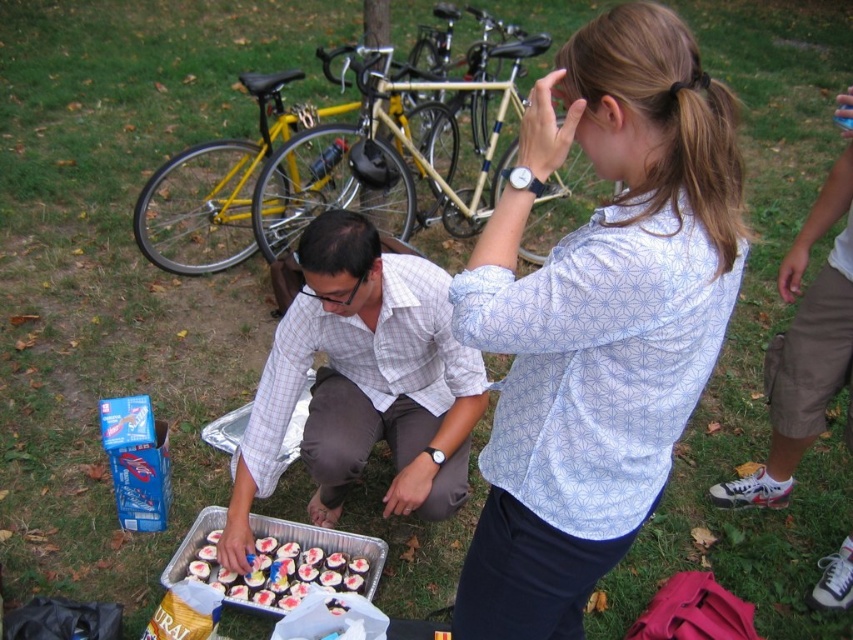
Question: Among these points, which one is nearest to the camera?

Choices:
 (A) (198, 148)
 (B) (383, 557)
 (C) (381, 298)
 (D) (500, 250)

Answer: (D)

Question: Does white printed shirt at center come in front of chocolate frosted cupcakes at lower center?

Choices:
 (A) no
 (B) yes

Answer: (B)

Question: Considering the real-world distances, which object is closest to the chocolate frosted cupcakes at lower center?

Choices:
 (A) yellow matte bicycle at upper left
 (B) light gray checkered shirt at center
 (C) white printed shirt at center

Answer: (B)

Question: Considering the relative positions of white printed shirt at center and yellow matte bicycle at upper left in the image provided, where is white printed shirt at center located with respect to yellow matte bicycle at upper left?

Choices:
 (A) below
 (B) above

Answer: (A)

Question: Is light gray checkered shirt at center above chocolate frosted cupcakes at lower center?

Choices:
 (A) yes
 (B) no

Answer: (A)

Question: Which point is farther from the camera taking this photo?

Choices:
 (A) (190, 572)
 (B) (672, 163)
 (C) (459, 216)

Answer: (C)